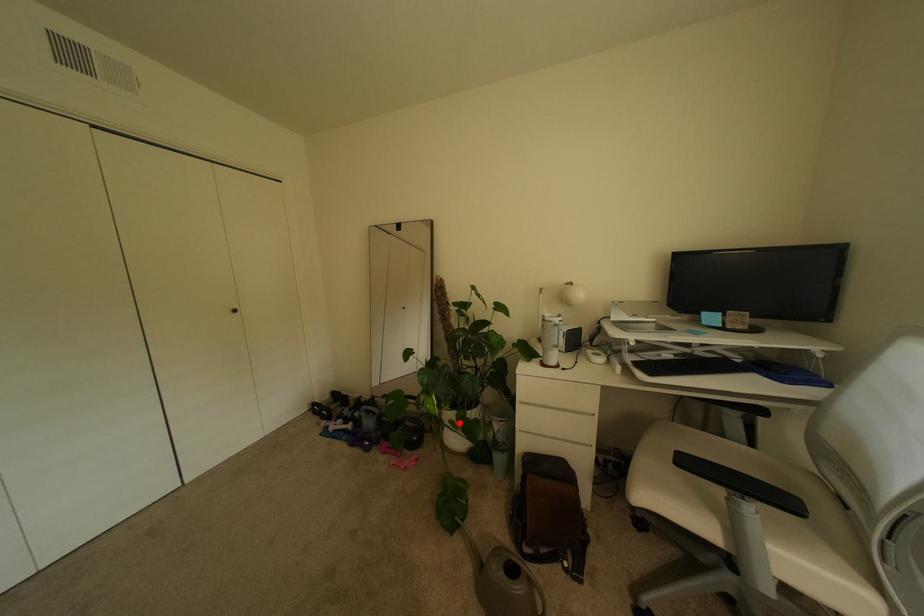
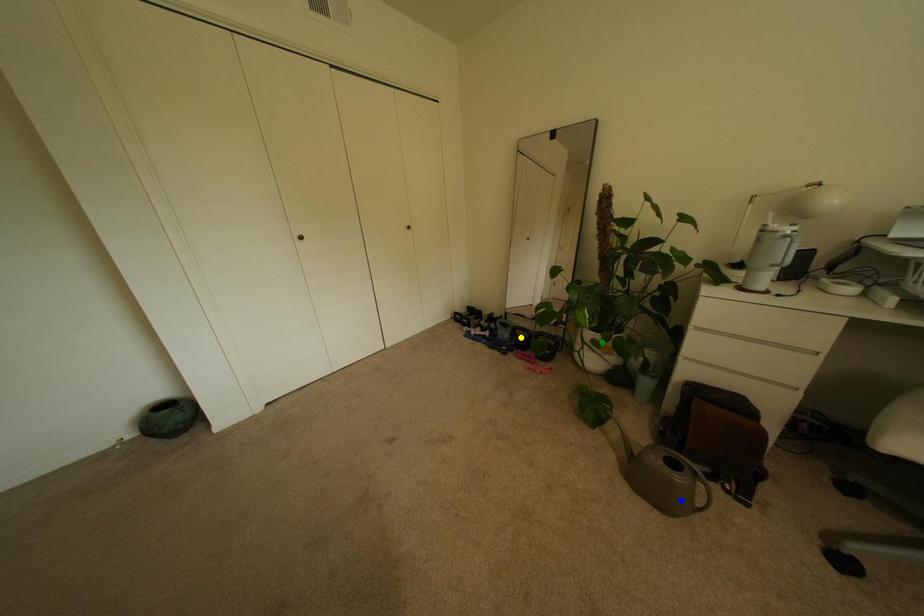
Question: I am providing you with two images of the same scene from different viewpoints. A red point is marked on the first image. You are given multiple points on the second image. Which point in image 2 is actually the same real-world point as the red point in image 1?

Choices:
 (A) yellow point
 (B) green point
 (C) blue point

Answer: (B)